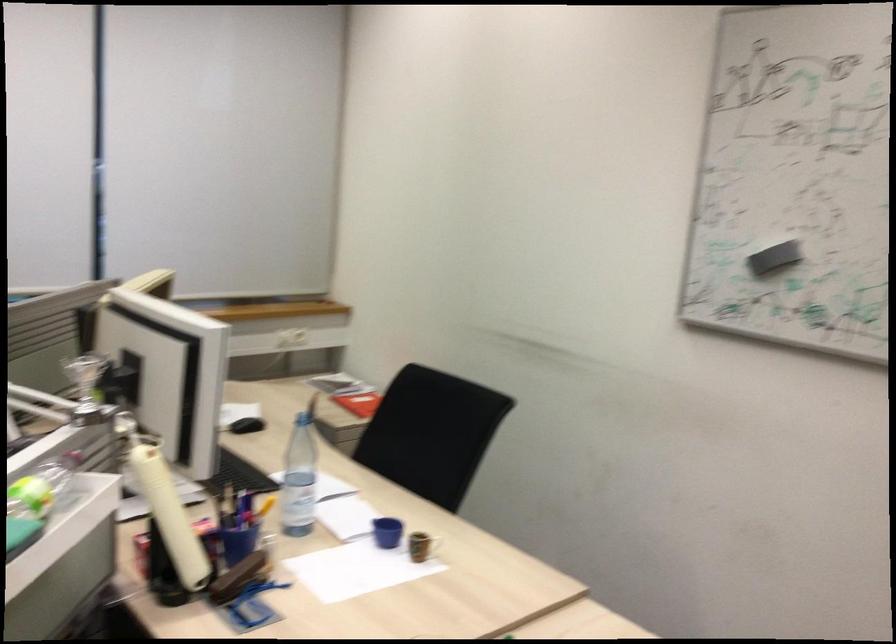
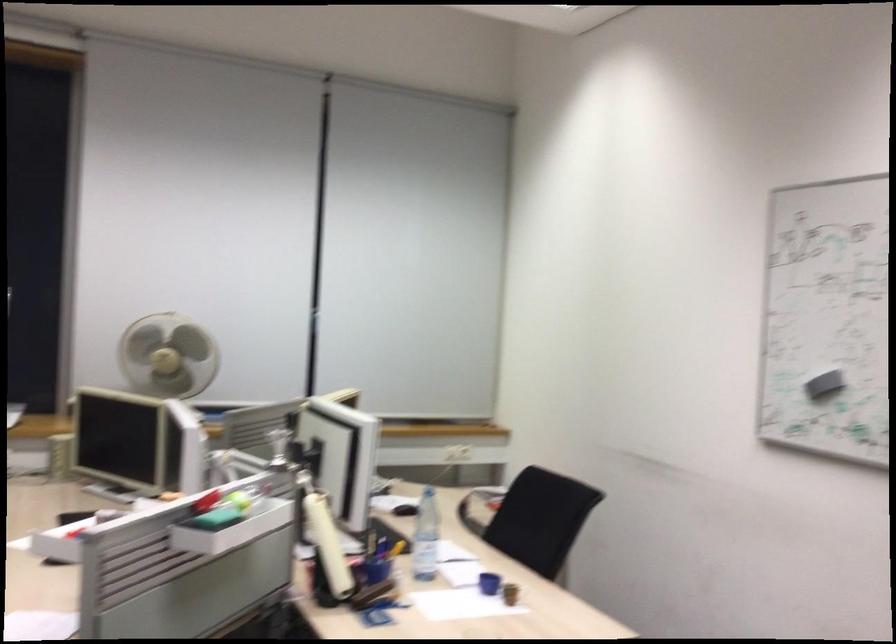
The point at (767, 267) is marked in the first image. Where is the corresponding point in the second image?

(823, 384)